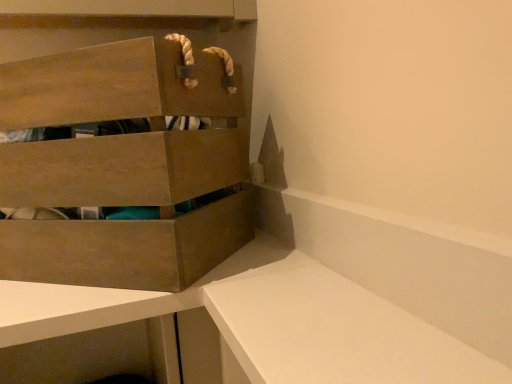
Question: Is wooden crate at upper left taller or shorter than white matte vanity at lower right?

Choices:
 (A) short
 (B) tall

Answer: (B)

Question: Looking at their shapes, would you say wooden crate at upper left is wider or thinner than white matte vanity at lower right?

Choices:
 (A) thin
 (B) wide

Answer: (B)

Question: Is wooden crate at upper left spatially inside white matte vanity at lower right, or outside of it?

Choices:
 (A) outside
 (B) inside

Answer: (A)

Question: Does point (420, 319) appear closer or farther from the camera than point (39, 87)?

Choices:
 (A) closer
 (B) farther

Answer: (A)

Question: Considering their positions, is white matte vanity at lower right located in front of or behind wooden crate at upper left?

Choices:
 (A) front
 (B) behind

Answer: (A)

Question: Based on their sizes in the image, would you say white matte vanity at lower right is bigger or smaller than wooden crate at upper left?

Choices:
 (A) small
 (B) big

Answer: (A)

Question: From their relative heights in the image, would you say white matte vanity at lower right is taller or shorter than wooden crate at upper left?

Choices:
 (A) tall
 (B) short

Answer: (B)